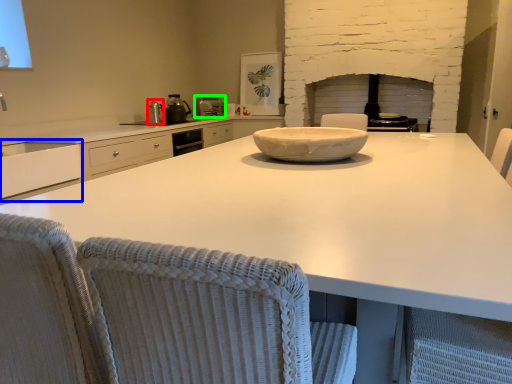
Question: Estimate the real-world distances between objects in this image. Which object is closer to appliance (highlighted by a red box), cabinetry (highlighted by a blue box) or kitchen appliance (highlighted by a green box)?

Choices:
 (A) cabinetry
 (B) kitchen appliance

Answer: (B)